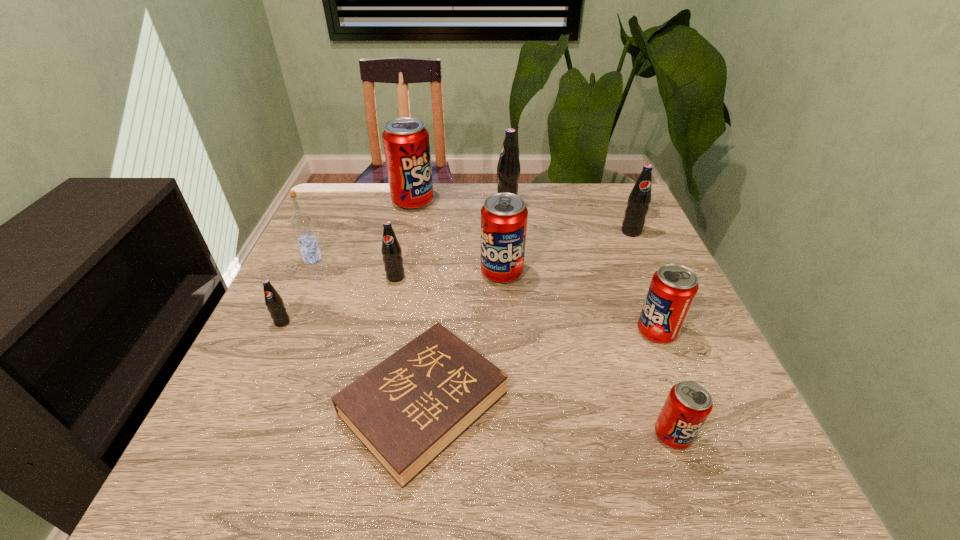
This screenshot has height=540, width=960. In order to click on the third black pop from right to left in this screenshot , I will do `click(391, 251)`.

You are a GUI agent. You are given a task and a screenshot of the screen. Output one action in this format:
    pyautogui.click(x=<x>, y=<y>)
    Task: Click on the second nearest red soda can
    The height and width of the screenshot is (540, 960).
    Given the screenshot: What is the action you would take?
    pyautogui.click(x=673, y=287)

The height and width of the screenshot is (540, 960). What are the coordinates of `the leftmost soda can` in the screenshot? It's located at (273, 301).

This screenshot has height=540, width=960. In order to click on the smallest black pop in this screenshot , I will do `click(273, 301)`.

You are a GUI agent. You are given a task and a screenshot of the screen. Output one action in this format:
    pyautogui.click(x=<x>, y=<y>)
    Task: Click on the nearest red soda can
    
    Given the screenshot: What is the action you would take?
    pyautogui.click(x=689, y=403)

Where is `the smallest red soda can`? Image resolution: width=960 pixels, height=540 pixels. the smallest red soda can is located at coordinates (689, 403).

Where is `hardback book`? This screenshot has height=540, width=960. hardback book is located at coordinates (x=408, y=409).

I want to click on brown hardback book, so click(x=408, y=409).

Locate an element on the screen. Image resolution: width=960 pixels, height=540 pixels. vacant space located 0.120m on the left of the leftmost red soda can is located at coordinates (351, 201).

Find the location of `free space located 0.150m on the front label of the biggest black pop`. free space located 0.150m on the front label of the biggest black pop is located at coordinates (444, 207).